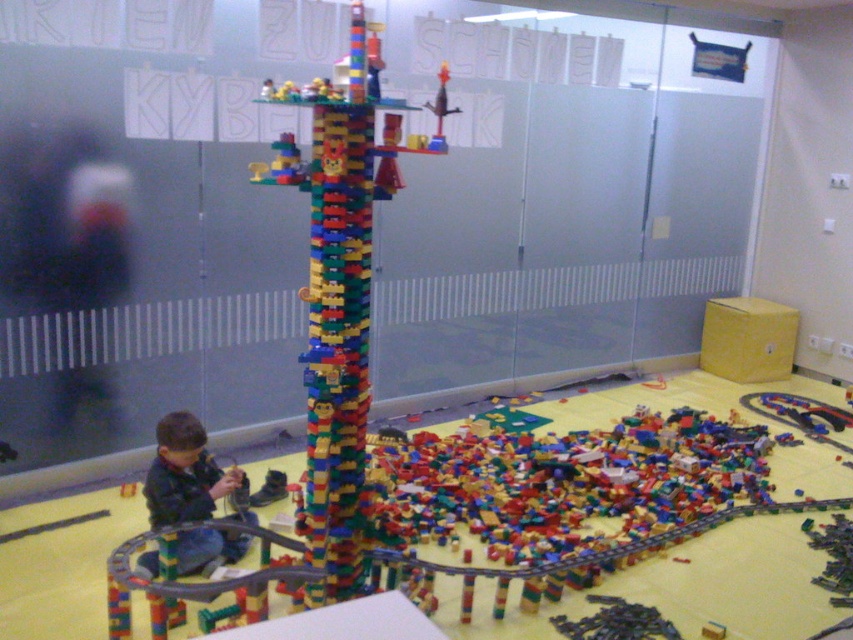
Who is more forward, (329, 422) or (154, 493)?

Positioned in front is point (329, 422).

What do you see at coordinates (339, 305) in the screenshot? The width and height of the screenshot is (853, 640). I see `multicolored plastic tower at center` at bounding box center [339, 305].

Is point (364, 202) positioned before point (225, 492)?

That is True.

You are a GUI agent. You are given a task and a screenshot of the screen. Output one action in this format:
    pyautogui.click(x=<x>, y=<y>)
    Task: Click on the multicolored plastic tower at center
    This screenshot has width=853, height=640.
    Given the screenshot: What is the action you would take?
    pyautogui.click(x=339, y=305)